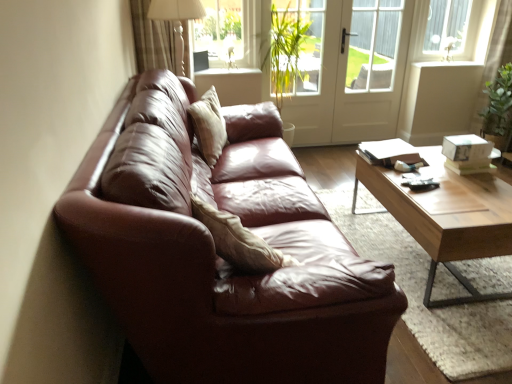
Where is `white glossy door at center`? white glossy door at center is located at coordinates pos(355,74).

The image size is (512, 384). What do you see at coordinates (444, 30) in the screenshot? I see `white plastic window frame at upper right` at bounding box center [444, 30].

I want to click on beige fabric pillow at center, so click(x=209, y=126).

Identify the location of matte white table lamp at upper center. (177, 21).

Find the location of `green leafy plant at center`. green leafy plant at center is located at coordinates (291, 50).

In terms of size, does green leafy plant at center appear bigger or smaller than transparent glass window at upper center?

In the image, green leafy plant at center appears to be larger than transparent glass window at upper center.

Is green leafy plant at center at the right side of transparent glass window at upper center?

Correct, you'll find green leafy plant at center to the right of transparent glass window at upper center.

Can transparent glass window at upper center be found inside green leafy plant at center?

Actually, transparent glass window at upper center is outside green leafy plant at center.

In the scene shown: Which point is more distant from viewer, (x=306, y=30) or (x=268, y=9)?

The point (x=306, y=30) is behind.

Relative to green leafy plant at center, is light brown wooden coffee table at center in front or behind?

Clearly, light brown wooden coffee table at center is in front of green leafy plant at center.

Is light brown wooden coffee table at center smaller than green leafy plant at center?

No.

From the picture: Between light brown wooden coffee table at center and green leafy plant at center, which one has larger width?

light brown wooden coffee table at center.

From the image's perspective, is light brown wooden coffee table at center located above or below green leafy plant at center?

From the image's perspective, light brown wooden coffee table at center appears below green leafy plant at center.

How different are the orientations of transparent glass window at upper center and white glossy door at center in degrees?

The angular difference between transparent glass window at upper center and white glossy door at center is 0.00216 degrees.

Is transparent glass window at upper center taller or shorter than white glossy door at center?

Clearly, transparent glass window at upper center is shorter compared to white glossy door at center.

Looking at this image, is transparent glass window at upper center to the left of white glossy door at center from the viewer's perspective?

Yes.

Which object is closer to the camera taking this photo, transparent glass window at upper center or white glossy door at center?

transparent glass window at upper center.

Is white glossy door at center oriented away from light brown wooden coffee table at center?

white glossy door at center does not have its back to light brown wooden coffee table at center.

Is point (389, 109) positioned after point (459, 236)?

Yes, point (389, 109) is farther from viewer.

Is white glossy door at center wider than light brown wooden coffee table at center?

In fact, white glossy door at center might be narrower than light brown wooden coffee table at center.

From the image's perspective, who appears lower, white glossy door at center or light brown wooden coffee table at center?

light brown wooden coffee table at center appears lower in the image.

Considering the relative sizes of green leafy plant at center and light brown wooden coffee table at center in the image provided, is green leafy plant at center bigger than light brown wooden coffee table at center?

Actually, green leafy plant at center might be smaller than light brown wooden coffee table at center.

Is green leafy plant at center positioned with its back to light brown wooden coffee table at center?

green leafy plant at center does not have its back to light brown wooden coffee table at center.

Considering the positions of objects green leafy plant at center and light brown wooden coffee table at center in the image provided, who is behind, green leafy plant at center or light brown wooden coffee table at center?

green leafy plant at center is behind.

Which object is positioned more to the left, green leafy plant at center or light brown wooden coffee table at center?

green leafy plant at center.

Would you say light brown wooden coffee table at center is to the left or to the right of beige fabric pillow at center in the picture?

Clearly, light brown wooden coffee table at center is on the right of beige fabric pillow at center in the image.

From a real-world perspective, is light brown wooden coffee table at center located beneath beige fabric pillow at center?

Yes.

Is light brown wooden coffee table at center oriented away from beige fabric pillow at center?

Yes, beige fabric pillow at center is at the back of light brown wooden coffee table at center.

Can you tell me how much light brown wooden coffee table at center and beige fabric pillow at center differ in facing direction?

There is a 14.8-degree angle between the facing directions of light brown wooden coffee table at center and beige fabric pillow at center.

Can you confirm if white plastic window frame at upper right is shorter than beige fabric pillow at center?

Incorrect, the height of white plastic window frame at upper right does not fall short of that of beige fabric pillow at center.

Which is more to the right, white plastic window frame at upper right or beige fabric pillow at center?

From the viewer's perspective, white plastic window frame at upper right appears more on the right side.

Between white plastic window frame at upper right and beige fabric pillow at center, which one has smaller width?

With smaller width is white plastic window frame at upper right.

At what (x,y) coordinates should I click in order to perform the action: click on window frame above the beige fabric pillow at center (from a real-world perspective). Please return your answer as a coordinate pair (x, y). Looking at the image, I should click on (444, 30).

This screenshot has width=512, height=384. Find the location of `plant that is behind the transparent glass window at upper center`. plant that is behind the transparent glass window at upper center is located at coordinates (291, 50).

This screenshot has height=384, width=512. I want to click on plant above the light brown wooden coffee table at center (from a real-world perspective), so click(291, 50).

Estimate the real-world distances between objects in this image. Which object is further from transparent glass window at upper center, beige fabric pillow at center or matte white table lamp at upper center?

beige fabric pillow at center lies further to transparent glass window at upper center than the other object.

Estimate the real-world distances between objects in this image. Which object is closer to beige fabric pillow at center, light brown wooden coffee table at center or green leafy plant at center?

Among the two, green leafy plant at center is located nearer to beige fabric pillow at center.

Based on their spatial positions, is transparent glass window at upper center or white glossy door at center closer to light brown wooden coffee table at center?

white glossy door at center is positioned closer to the anchor light brown wooden coffee table at center.

Based on their spatial positions, is green leafy plant at center or white glossy door at center further from beige fabric pillow at center?

white glossy door at center is further to beige fabric pillow at center.

Which object lies further to the anchor point white glossy door at center, green leafy plant at center or beige fabric pillow at center?

beige fabric pillow at center lies further to white glossy door at center than the other object.

When comparing their distances from transparent glass window at upper center, does white plastic window frame at upper right or white glossy door at center seem closer?

white glossy door at center is positioned closer to the anchor transparent glass window at upper center.

When comparing their distances from white plastic window frame at upper right, does light brown wooden coffee table at center or green leafy plant at center seem closer?

green leafy plant at center is positioned closer to the anchor white plastic window frame at upper right.

From the image, which object appears to be farther from white glossy door at center, green leafy plant at center or light brown wooden coffee table at center?

light brown wooden coffee table at center.

Find the location of a particular element. The width and height of the screenshot is (512, 384). plant positioned between light brown wooden coffee table at center and white plastic window frame at upper right from near to far is located at coordinates (291, 50).

In order to click on screen door between transparent glass window at upper center and white plastic window frame at upper right in this screenshot , I will do `click(355, 74)`.

Where is `screen door situated between beige fabric pillow at center and white plastic window frame at upper right from left to right`? screen door situated between beige fabric pillow at center and white plastic window frame at upper right from left to right is located at coordinates (355, 74).

You are a GUI agent. You are given a task and a screenshot of the screen. Output one action in this format:
    pyautogui.click(x=<x>, y=<y>)
    Task: Click on the plant between transparent glass window at upper center and white plastic window frame at upper right
    
    Given the screenshot: What is the action you would take?
    pyautogui.click(x=291, y=50)